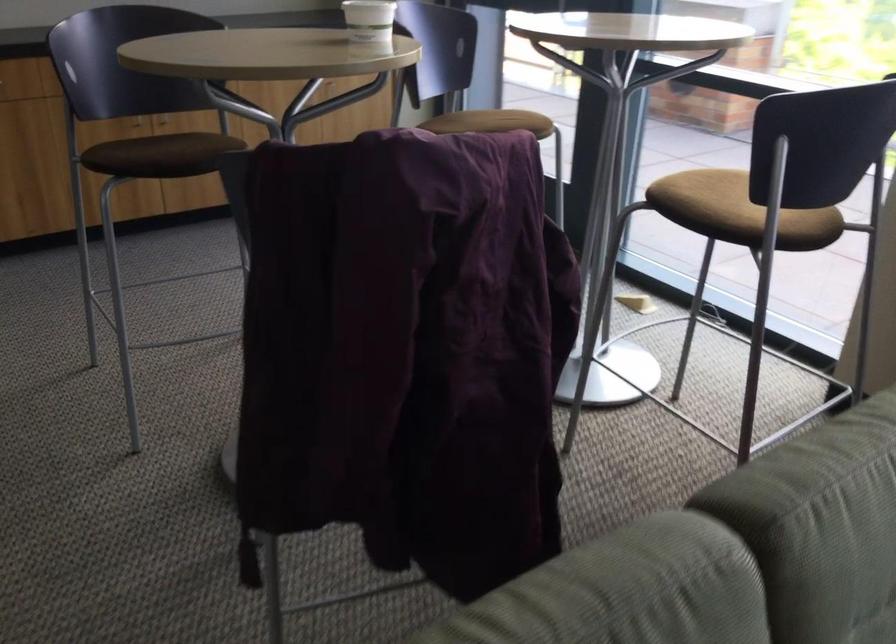
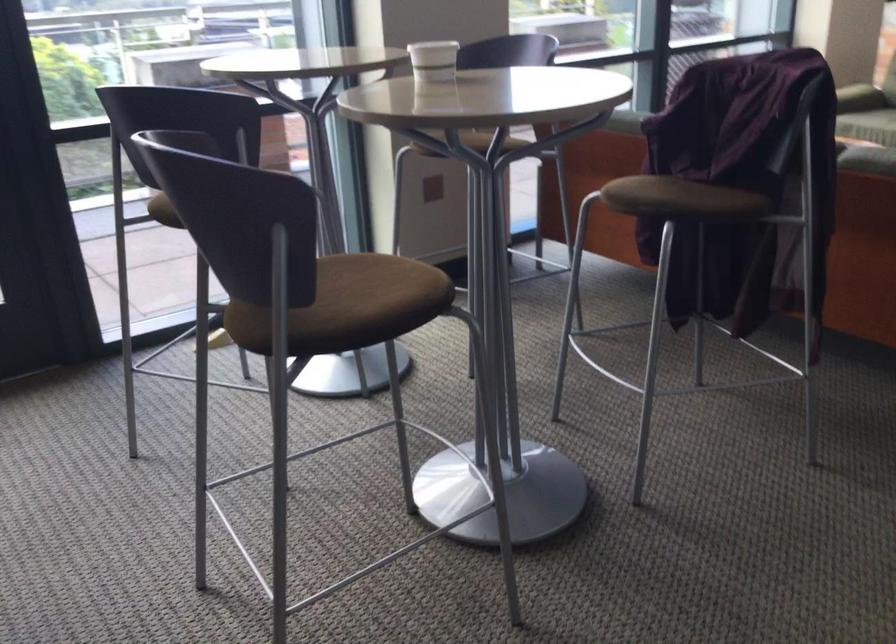
Locate, in the second image, the point that corresponds to point (471, 113) in the first image.

(162, 211)